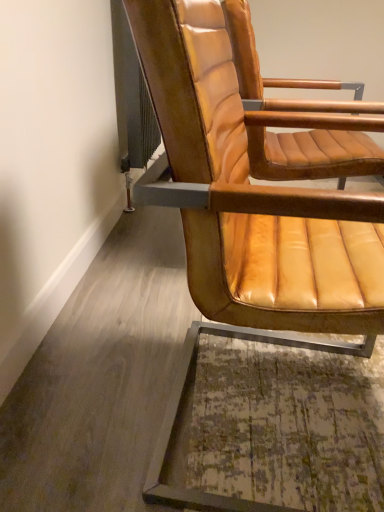
Find the location of a particular element. Image resolution: width=384 pixels, height=512 pixels. free point below leather at right, which is the 2th chair from back to front (from a real-world perspective) is located at coordinates (279, 414).